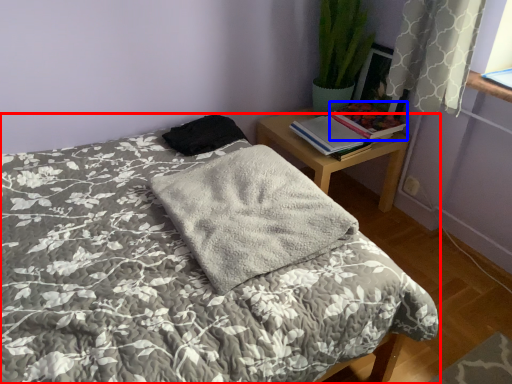
Question: Which of the following is the farthest to the observer, bed (highlighted by a red box) or book (highlighted by a blue box)?

Choices:
 (A) bed
 (B) book

Answer: (B)